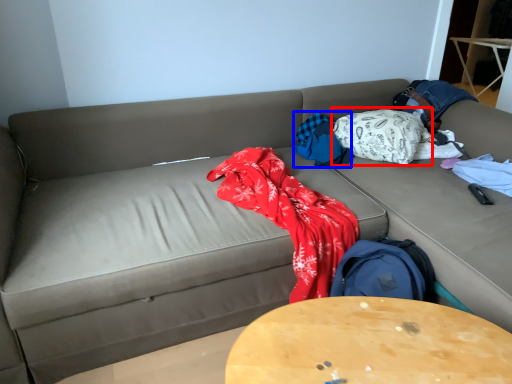
Question: Which of the following is the farthest to the observer, blanket (highlighted by a red box) or blanket (highlighted by a blue box)?

Choices:
 (A) blanket
 (B) blanket

Answer: (B)